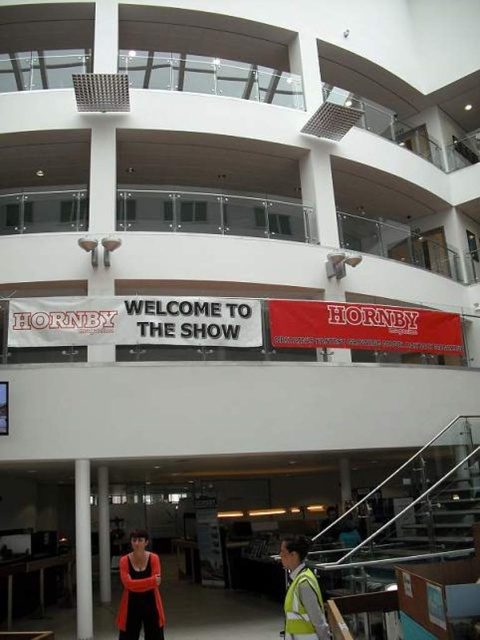
Question: From the image, what is the correct spatial relationship of orange fabric construction vest at lower center in relation to reflective yellow safety vest at lower center?

Choices:
 (A) above
 (B) below

Answer: (B)

Question: Which point is closer to the camera taking this photo?

Choices:
 (A) (315, 598)
 (B) (87, 588)

Answer: (A)

Question: Which point is farther to the camera?

Choices:
 (A) click(129, 595)
 (B) click(294, 596)

Answer: (A)

Question: Can you confirm if orange fabric construction vest at lower center is bigger than white glossy pillar at lower center?

Choices:
 (A) no
 (B) yes

Answer: (A)

Question: Is orange fabric construction vest at lower center smaller than reflective yellow safety vest at lower center?

Choices:
 (A) no
 (B) yes

Answer: (A)

Question: Which point is farther to the camera?

Choices:
 (A) reflective yellow safety vest at lower center
 (B) white glossy pillar at center

Answer: (B)